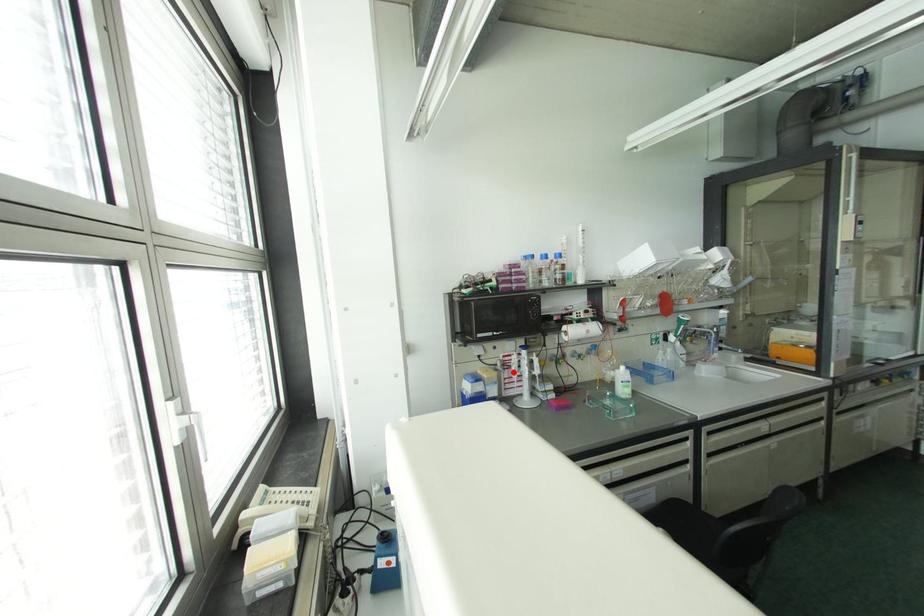
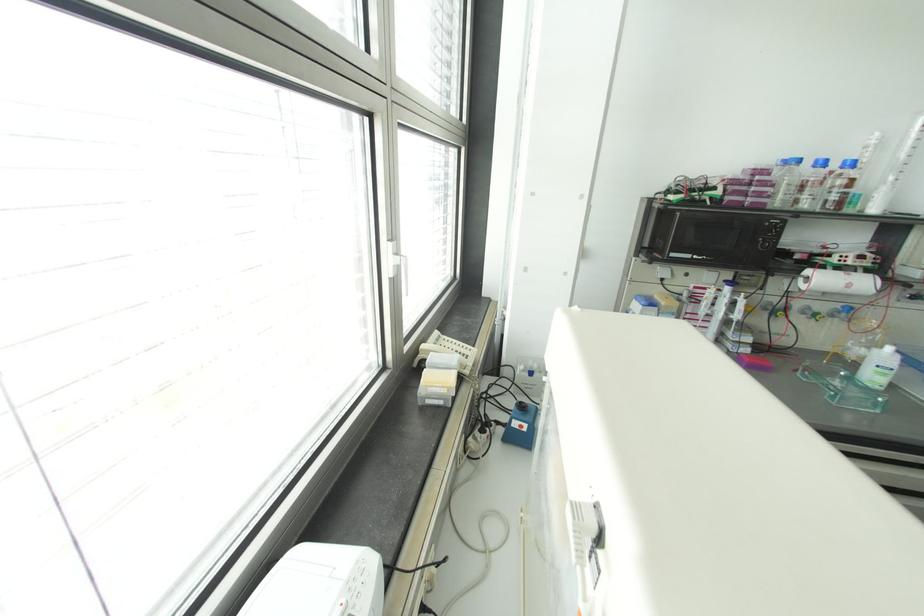
Where in the second image is the point corresponding to the highlighted location from the first image?

(702, 309)